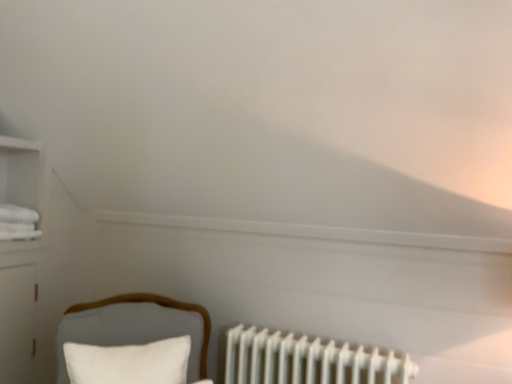
Question: Would you say white soft pillow at lower left is inside or outside white matte radiator at lower right?

Choices:
 (A) inside
 (B) outside

Answer: (B)

Question: Is point (92, 357) positioned closer to the camera than point (245, 370)?

Choices:
 (A) closer
 (B) farther

Answer: (A)

Question: Estimate the real-world distances between objects in this image. Which object is farther from the white soft pillow at lower left?

Choices:
 (A) velvet white chair at lower left
 (B) white matte radiator at lower right

Answer: (B)

Question: Considering the real-world distances, which object is closest to the velvet white chair at lower left?

Choices:
 (A) white soft pillow at lower left
 (B) white matte radiator at lower right

Answer: (A)